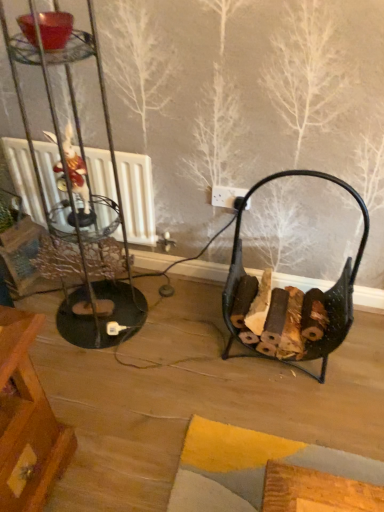
Locate an element on the screen. This screenshot has width=384, height=512. vacant area that is in front of black metal firewood basket at lower right is located at coordinates (283, 418).